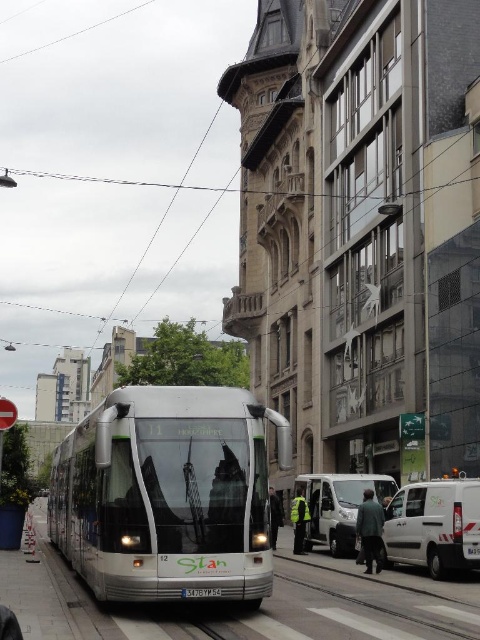
Is point (232, 525) in front of point (351, 540)?

Yes, it is in front of point (351, 540).

Which is more to the left, silver metallic bus at center or white matte van at lower center?

silver metallic bus at center

Where is `silver metallic bus at center`? silver metallic bus at center is located at coordinates (168, 493).

Identify the location of silver metallic bus at center. pyautogui.click(x=168, y=493).

Does white matte van at lower right have a lesser width compared to white matte van at lower center?

Yes, white matte van at lower right is thinner than white matte van at lower center.

Between point (423, 481) and point (372, 483), which one is positioned behind?

The point (423, 481) is more distant.

Find the location of `white matte van at lower right`. white matte van at lower right is located at coordinates (433, 525).

Is point (104, 460) less distant than point (432, 500)?

Yes.

Is silver metallic bus at center thinner than white matte van at lower right?

No, silver metallic bus at center is not thinner than white matte van at lower right.

Between point (195, 541) and point (440, 516), which one is positioned behind?

Positioned behind is point (440, 516).

Image resolution: width=480 pixels, height=640 pixels. I want to click on silver metallic bus at center, so click(x=168, y=493).